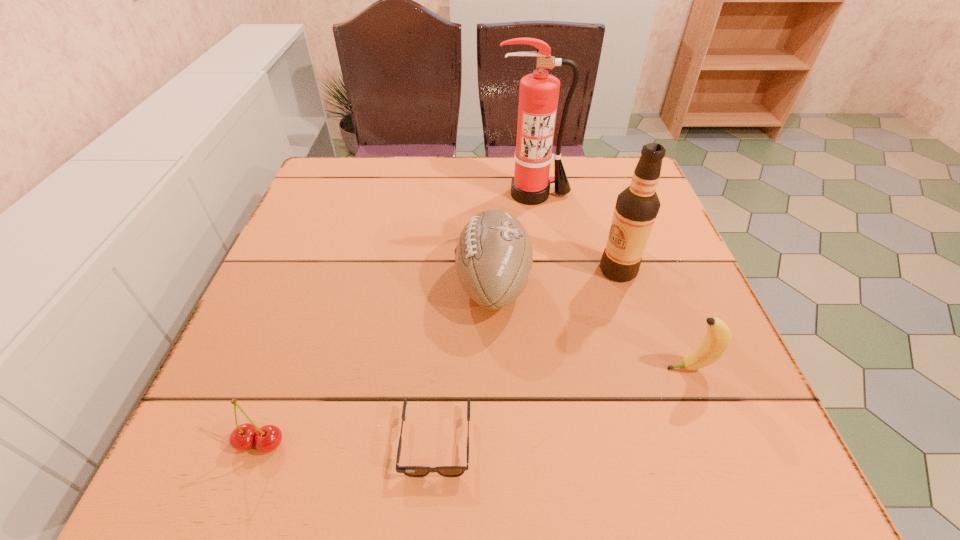
I want to click on free space located on the label of the alcohol, so click(x=425, y=270).

At what (x,y) coordinates should I click in order to perform the action: click on free space located 0.050m on the label of the alcohol. Please return your answer as a coordinate pair (x, y). The width and height of the screenshot is (960, 540). Looking at the image, I should click on (576, 270).

At what (x,y) coordinates should I click in order to perform the action: click on free space located 0.360m on the laces of the football (American). Please return your answer as a coordinate pair (x, y). The image size is (960, 540). Looking at the image, I should click on (282, 284).

The width and height of the screenshot is (960, 540). Identify the location of vacant area situated 0.220m on the laces of the football (American). (349, 284).

The width and height of the screenshot is (960, 540). What are the coordinates of `vacant region located 0.260m on the laces of the football (American)` in the screenshot? It's located at (330, 284).

Image resolution: width=960 pixels, height=540 pixels. In order to click on vacant region located from the stem of the third nearest object in this screenshot , I will do `click(558, 368)`.

Locate an element on the screen. vacant space located from the stem of the third nearest object is located at coordinates (x=444, y=368).

The image size is (960, 540). I want to click on free space located 0.290m from the stem of the third nearest object, so click(501, 368).

Find the location of a particular element. object that is at the far edge is located at coordinates (538, 96).

Where is `cherry situated at the near edge`? cherry situated at the near edge is located at coordinates (267, 438).